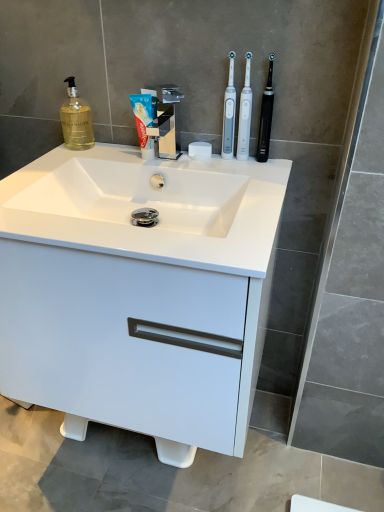
At what (x,y) coordinates should I click in order to perform the action: click on vacant space that is to the left of black rubberized toothbrush at upper right, placed as the 1th toothbrush when sorted from right to left. Please return your answer as a coordinate pair (x, y). Image resolution: width=384 pixels, height=512 pixels. Looking at the image, I should click on (206, 162).